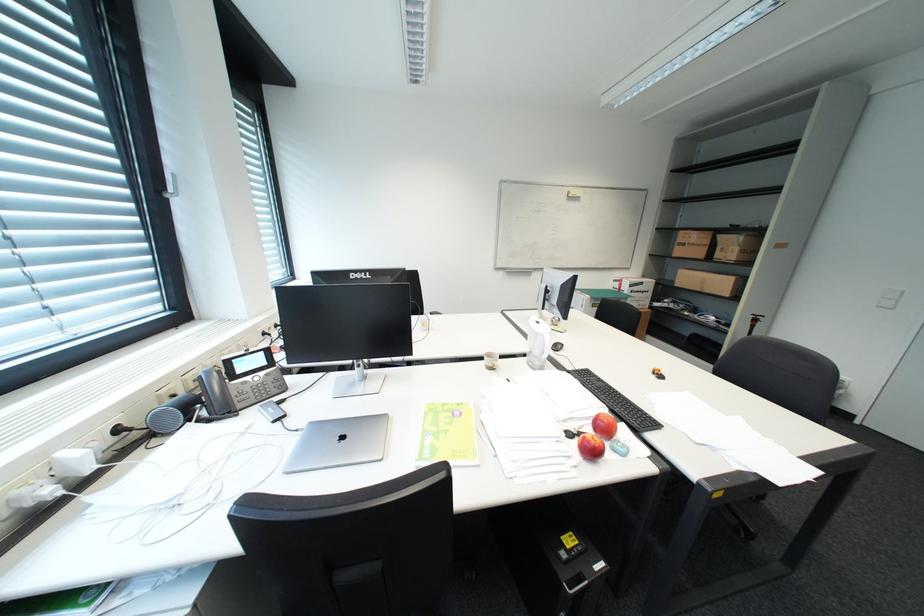
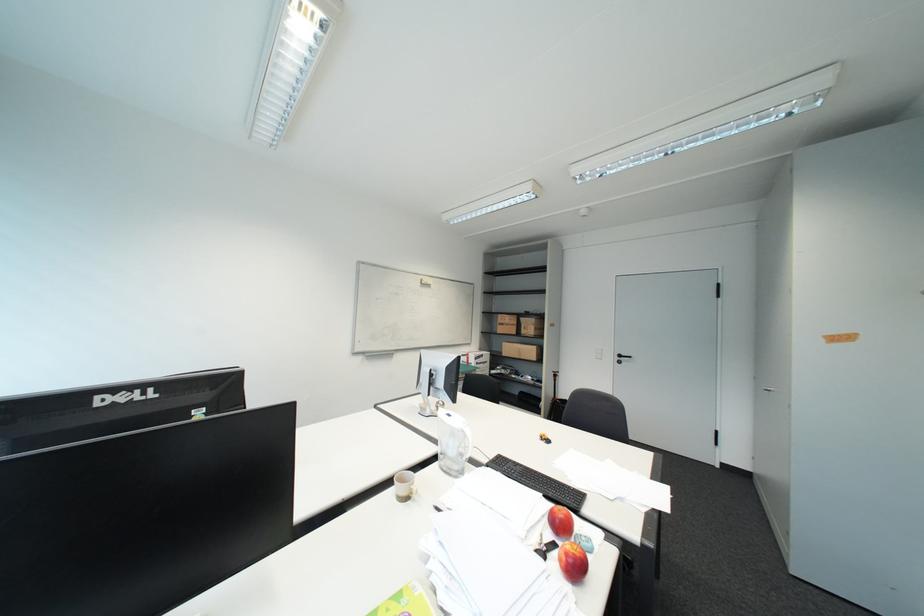
Question: The first image is from the beginning of the video and the second image is from the end. How did the camera likely rotate when shooting the video?

Choices:
 (A) Left
 (B) Right
 (C) Up
 (D) Down

Answer: (B)